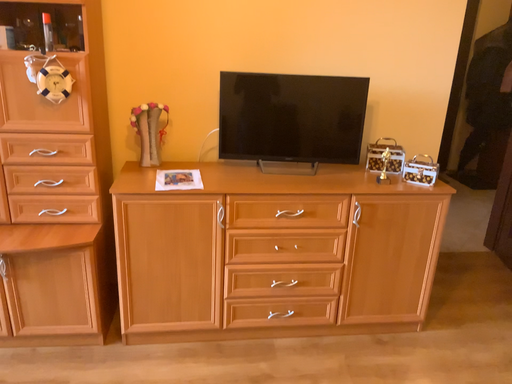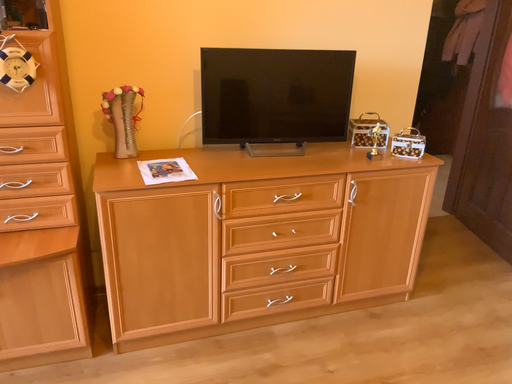
Question: How did the camera likely rotate when shooting the video?

Choices:
 (A) rotated right
 (B) rotated left

Answer: (A)